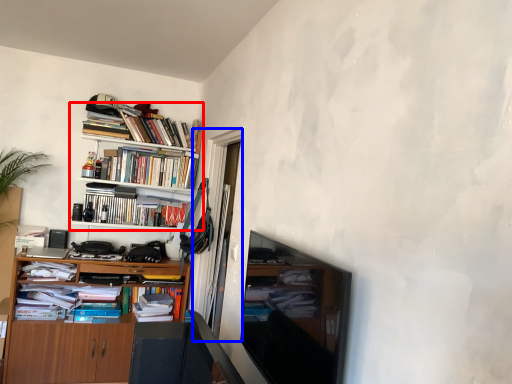
Question: Which object appears closest to the camera in this image, bookcase (highlighted by a red box) or glass door (highlighted by a blue box)?

Choices:
 (A) bookcase
 (B) glass door

Answer: (B)